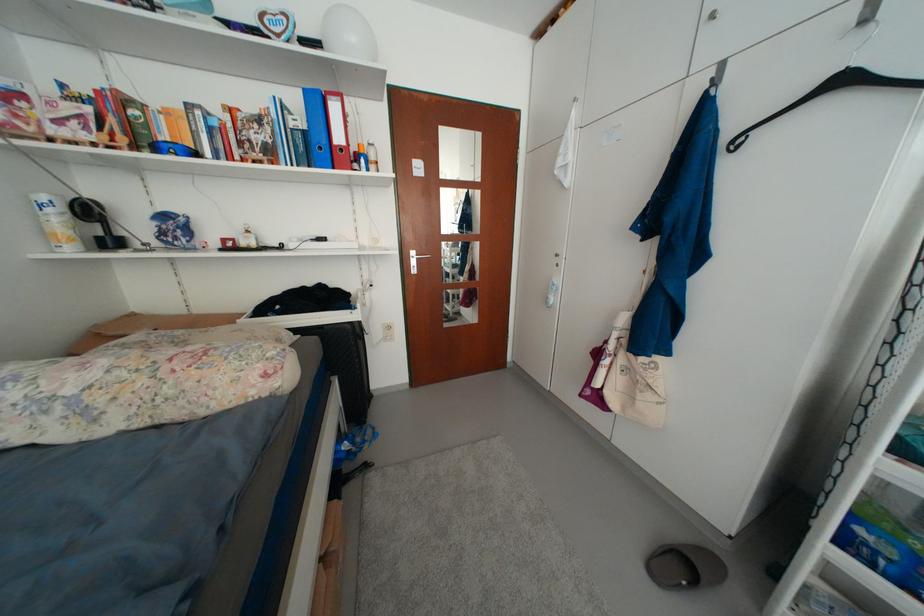
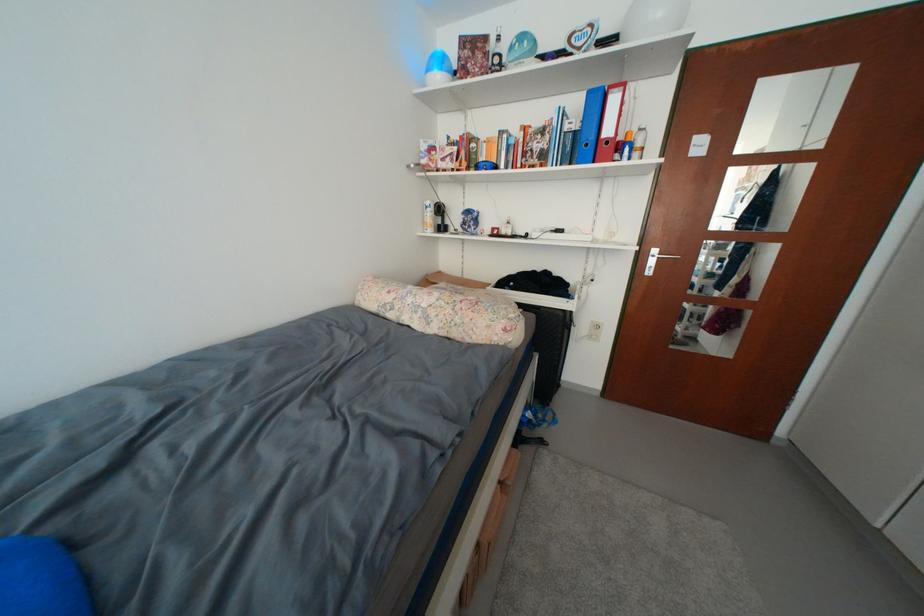
The point at (55, 238) is marked in the first image. Where is the corresponding point in the second image?

(432, 225)